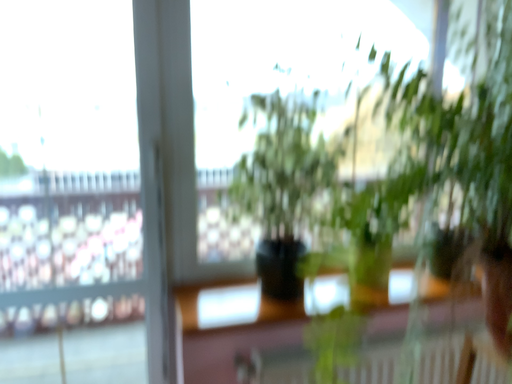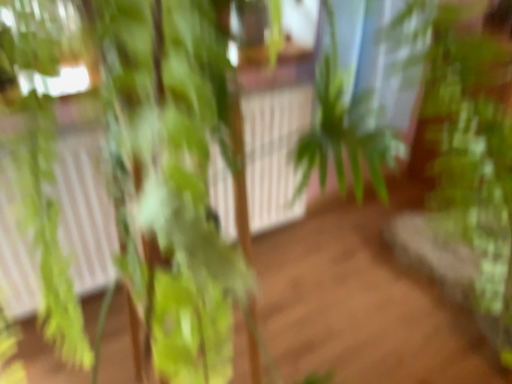
Question: Which way did the camera rotate in the video?

Choices:
 (A) rotated right
 (B) rotated left

Answer: (A)